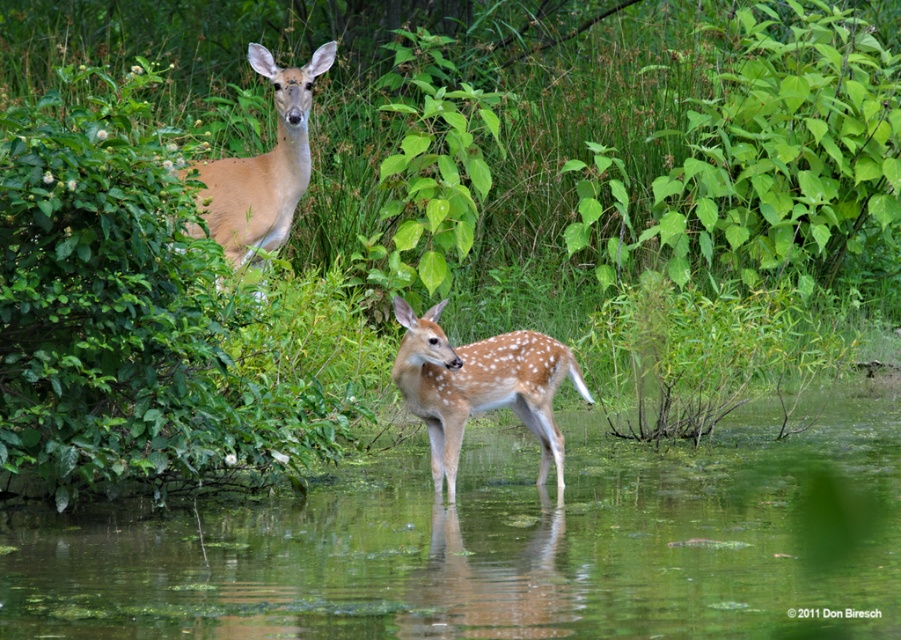
Which is more to the right, fawn fur deer at center or light brown fur at upper left?

Positioned to the right is fawn fur deer at center.

Which of these two, fawn fur deer at center or light brown fur at upper left, stands taller?

light brown fur at upper left

Who is more distant from viewer, (417, 362) or (284, 140)?

The point (284, 140) is behind.

In order to click on fawn fur deer at center in this screenshot , I will do `click(480, 387)`.

Which is below, green liquid water at lower center or light brown fur at upper left?

green liquid water at lower center is lower down.

Can you confirm if green liquid water at lower center is shorter than light brown fur at upper left?

Indeed, green liquid water at lower center has a lesser height compared to light brown fur at upper left.

Does point (676, 531) lie behind point (253, 184)?

No, (676, 531) is closer to viewer.

What are the coordinates of `green liquid water at lower center` in the screenshot? It's located at (505, 545).

Is green liquid water at lower center further to the viewer compared to fawn fur deer at center?

No, green liquid water at lower center is in front of fawn fur deer at center.

Between point (101, 536) and point (441, 456), which one is positioned behind?

Point (441, 456)

Where is `green liquid water at lower center`? The height and width of the screenshot is (640, 901). green liquid water at lower center is located at coordinates (505, 545).